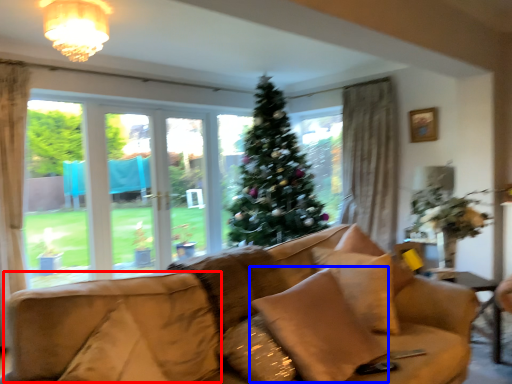
Question: Among these objects, which one is nearest to the camera, swivel chair (highlighted by a red box) or pillow (highlighted by a blue box)?

Choices:
 (A) swivel chair
 (B) pillow

Answer: (A)